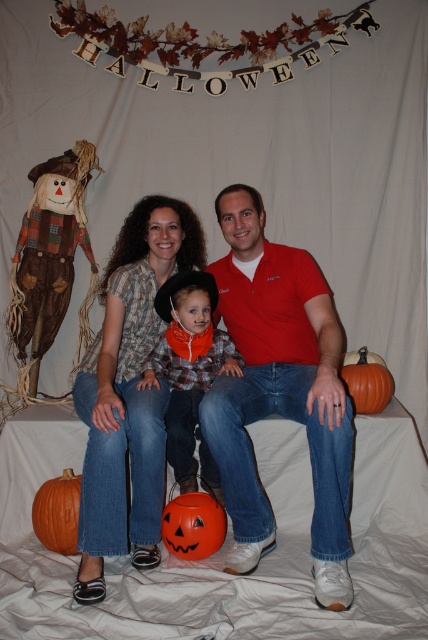
Is point (294, 392) positioned before point (344, 376)?

Yes, it is in front of point (344, 376).

Is point (219, 195) farther from camera compared to point (369, 390)?

No.

Locate an element on the screen. red cotton shirt at center is located at coordinates coord(279,390).

Is point (171, 280) positioned after point (371, 353)?

No, (171, 280) is in front of (371, 353).

Which is more to the left, plaid fabric shirt at center or orange matte pumpkin at lower right?

plaid fabric shirt at center

This screenshot has height=640, width=428. Find the location of `plaid fabric shirt at center`. plaid fabric shirt at center is located at coordinates (189, 371).

I want to click on plaid fabric shirt at center, so click(x=189, y=371).

Can you confirm if matte plaid shirt at center is taller than orange matte pumpkin at center?

Indeed, matte plaid shirt at center has a greater height compared to orange matte pumpkin at center.

Is matte plaid shirt at center to the right of orange matte pumpkin at center from the viewer's perspective?

Incorrect, matte plaid shirt at center is not on the right side of orange matte pumpkin at center.

Measure the distance between point (x=166, y=266) and camera.

Point (x=166, y=266) and camera are 2.65 meters apart.

Locate an element on the screen. The width and height of the screenshot is (428, 640). matte plaid shirt at center is located at coordinates 128,392.